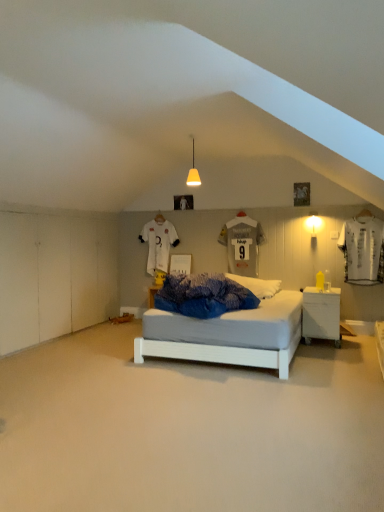
Question: Does white soft pillow at center come in front of white glossy nightstand at lower right?

Choices:
 (A) no
 (B) yes

Answer: (A)

Question: Considering the relative sizes of white soft pillow at center and white glossy nightstand at lower right in the image provided, is white soft pillow at center wider than white glossy nightstand at lower right?

Choices:
 (A) no
 (B) yes

Answer: (B)

Question: Is white glossy nightstand at lower right a part of white soft pillow at center?

Choices:
 (A) no
 (B) yes

Answer: (A)

Question: From the image's perspective, is white soft pillow at center located beneath white glossy nightstand at lower right?

Choices:
 (A) no
 (B) yes

Answer: (A)

Question: Is white soft pillow at center smaller than white glossy nightstand at lower right?

Choices:
 (A) no
 (B) yes

Answer: (A)

Question: Considering the positions of point (311, 242) and point (311, 315), is point (311, 242) closer or farther from the camera than point (311, 315)?

Choices:
 (A) farther
 (B) closer

Answer: (A)

Question: Is white matte wall sconce at right, which ranks as the second light fixture in top-to-bottom order, wider or thinner than white glossy nightstand at lower right?

Choices:
 (A) wide
 (B) thin

Answer: (B)

Question: Based on their sizes in the image, would you say white matte wall sconce at right, acting as the 2th light fixture starting from the left, is bigger or smaller than white glossy nightstand at lower right?

Choices:
 (A) small
 (B) big

Answer: (A)

Question: From a real-world perspective, is white matte wall sconce at right, acting as the first light fixture starting from the bottom, positioned above or below white glossy nightstand at lower right?

Choices:
 (A) above
 (B) below

Answer: (A)

Question: In terms of width, does white jersey at upper center, which is counted as the first t shirt, starting from the back, look wider or thinner when compared to white glossy nightstand at lower right?

Choices:
 (A) wide
 (B) thin

Answer: (B)

Question: Would you say white jersey at upper center, which is counted as the first t shirt, starting from the back, is to the left or to the right of white glossy nightstand at lower right in the picture?

Choices:
 (A) left
 (B) right

Answer: (A)

Question: Is white jersey at upper center, the 2th t shirt when ordered from front to back, spatially inside white glossy nightstand at lower right, or outside of it?

Choices:
 (A) inside
 (B) outside

Answer: (B)

Question: In the image, is white jersey at upper center, which is counted as the first t shirt, starting from the back, positioned in front of or behind white glossy nightstand at lower right?

Choices:
 (A) front
 (B) behind

Answer: (B)

Question: Is white matte wall sconce at right, acting as the 1th light fixture starting from the right, in front of or behind white smooth floor at center in the image?

Choices:
 (A) behind
 (B) front

Answer: (A)

Question: From a real-world perspective, relative to white smooth floor at center, is white matte wall sconce at right, arranged as the 2th light fixture when viewed from the front, vertically above or below?

Choices:
 (A) above
 (B) below

Answer: (A)